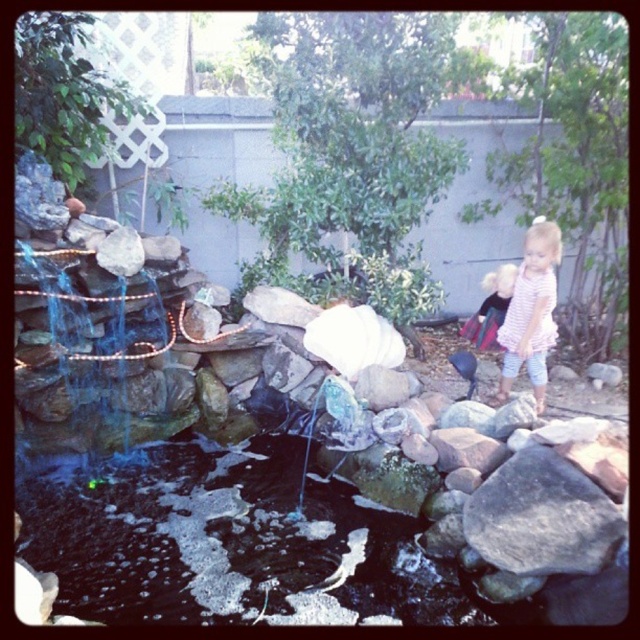
Is point (468, 317) positioned behind point (140, 243)?

That is True.

Between point (499, 320) and point (125, 257), which one is positioned in front?

Positioned in front is point (125, 257).

Does point (488, 332) come behind point (125, 256)?

Yes, it is behind point (125, 256).

In order to click on blonde hair child at right in this screenshot , I will do `click(490, 307)`.

Between pink cotton dress at center and white matte rock at center, which one appears on the right side from the viewer's perspective?

Positioned to the right is pink cotton dress at center.

Does pink cotton dress at center have a greater height compared to white matte rock at center?

Correct, pink cotton dress at center is much taller as white matte rock at center.

You are a GUI agent. You are given a task and a screenshot of the screen. Output one action in this format:
    pyautogui.click(x=<x>, y=<y>)
    Task: Click on the pink cotton dress at center
    This screenshot has height=640, width=640.
    Given the screenshot: What is the action you would take?
    pyautogui.click(x=531, y=310)

Between gray rough rock at lower right and blonde hair child at right, which one appears on the right side from the viewer's perspective?

blonde hair child at right

Does gray rough rock at lower right have a lesser width compared to blonde hair child at right?

In fact, gray rough rock at lower right might be wider than blonde hair child at right.

Is point (573, 561) in front of point (474, 337)?

Yes.

You are a GUI agent. You are given a task and a screenshot of the screen. Output one action in this format:
    pyautogui.click(x=<x>, y=<y>)
    Task: Click on the gray rough rock at lower right
    
    Given the screenshot: What is the action you would take?
    pyautogui.click(x=541, y=516)